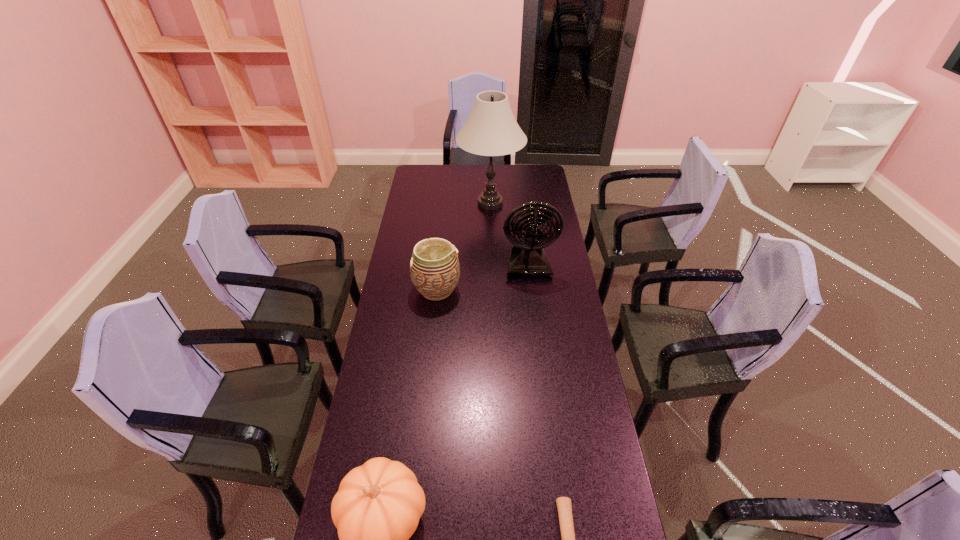
At what (x,y) coordinates should I click in order to perform the action: click on lamp. Please return your answer as a coordinate pair (x, y). This screenshot has width=960, height=540. Looking at the image, I should click on [x=491, y=130].

The width and height of the screenshot is (960, 540). I want to click on the farthest object, so click(491, 130).

Locate an element on the screen. The width and height of the screenshot is (960, 540). the fourth shortest object is located at coordinates (527, 258).

The image size is (960, 540). Identify the location of pottery. (434, 267).

Locate an element on the screen. Image resolution: width=960 pixels, height=540 pixels. vacant position located 0.190m on the front of the tallest object is located at coordinates (492, 246).

I want to click on free space located in front of the fourth shortest object to blow air, so click(536, 329).

Find the location of `free spot located on the right of the pottery`. free spot located on the right of the pottery is located at coordinates (537, 290).

The height and width of the screenshot is (540, 960). Identify the location of object at the far edge. (491, 130).

Where is `object that is positioned at the left edge`? The height and width of the screenshot is (540, 960). object that is positioned at the left edge is located at coordinates (434, 267).

Locate an element on the screen. This screenshot has height=540, width=960. object positioned at the right edge is located at coordinates (527, 258).